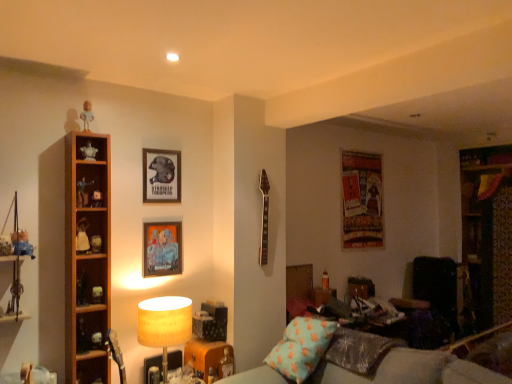
Question: Is matte beige lampshade at lower left shorter than white glossy figurine at left, which is counted as the 4th toy, starting from the bottom?

Choices:
 (A) yes
 (B) no

Answer: (B)

Question: Can you confirm if matte beige lampshade at lower left is thinner than white glossy figurine at left, which is the ninth toy from left to right?

Choices:
 (A) no
 (B) yes

Answer: (A)

Question: Is white glossy figurine at left, the 3th toy from the right, a part of matte beige lampshade at lower left?

Choices:
 (A) yes
 (B) no

Answer: (B)

Question: Is matte beige lampshade at lower left closer to camera compared to white glossy figurine at left, which is counted as the 4th toy, starting from the bottom?

Choices:
 (A) no
 (B) yes

Answer: (B)

Question: From a real-world perspective, is matte beige lampshade at lower left beneath white glossy figurine at left, which is the ninth toy from left to right?

Choices:
 (A) no
 (B) yes

Answer: (B)

Question: From the image's perspective, is matte beige lampshade at lower left over white glossy figurine at left, placed as the eighth toy when sorted from top to bottom?

Choices:
 (A) yes
 (B) no

Answer: (B)

Question: Does matte plastic picture frame at center, positioned as the 1th picture frame in front-to-back order, have a lesser width compared to matte plastic action figure at left, marked as the 5th toy in a left-to-right arrangement?

Choices:
 (A) yes
 (B) no

Answer: (A)

Question: Can matte plastic action figure at left, the 9th toy from the bottom, be found inside matte plastic picture frame at center, which is the second picture frame in right-to-left order?

Choices:
 (A) yes
 (B) no

Answer: (B)

Question: From a real-world perspective, is matte plastic picture frame at center, acting as the 3th picture frame starting from the back, on top of matte plastic action figure at left, marked as the 5th toy in a left-to-right arrangement?

Choices:
 (A) no
 (B) yes

Answer: (A)

Question: Is matte plastic picture frame at center, positioned as the second picture frame in left-to-right order, closer to camera compared to matte plastic action figure at left, marked as the 5th toy in a left-to-right arrangement?

Choices:
 (A) yes
 (B) no

Answer: (B)

Question: Is matte plastic picture frame at center, which is the second picture frame in right-to-left order, to the left of matte plastic action figure at left, the third toy positioned from the top, from the viewer's perspective?

Choices:
 (A) no
 (B) yes

Answer: (A)

Question: From the image's perspective, is matte plastic picture frame at center, positioned as the 1th picture frame in front-to-back order, beneath matte plastic action figure at left, the 9th toy from the bottom?

Choices:
 (A) yes
 (B) no

Answer: (A)

Question: From the image's perspective, is matte black figurine at left, which is the 9th toy from top to bottom, above matte white figurine at left, arranged as the 2th toy when viewed from the left?

Choices:
 (A) no
 (B) yes

Answer: (A)